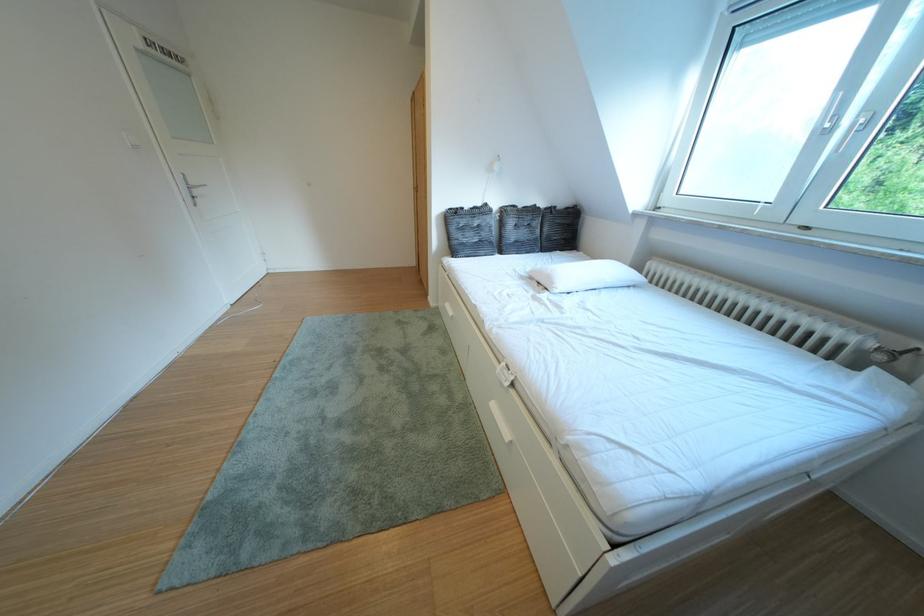
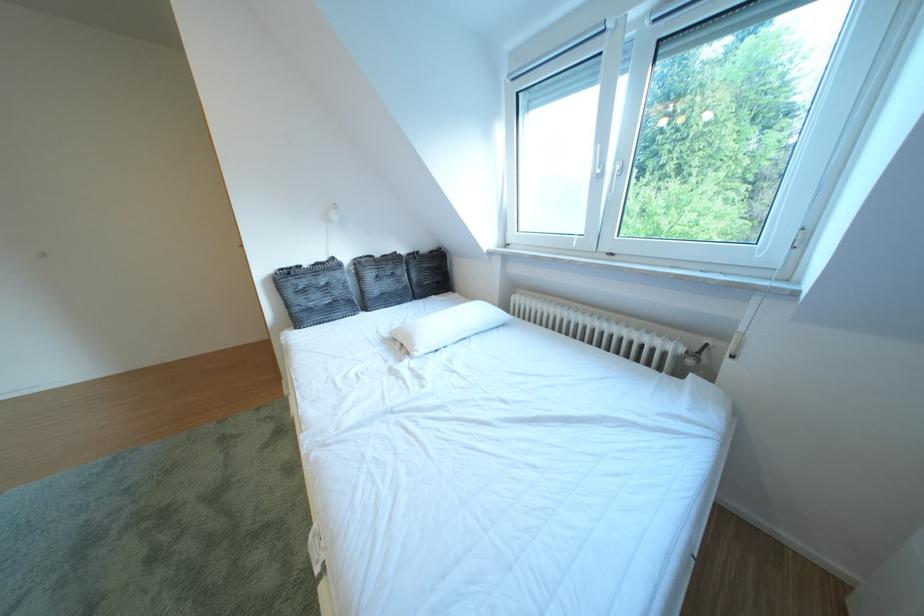
Which direction would the cameraman need to move to produce the second image?

The movement direction of the cameraman is right, forward.